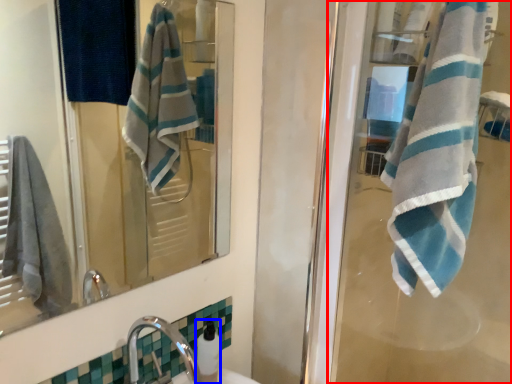
Question: Which point is closer to the camera, screen door (highlighted by a red box) or soap dispenser (highlighted by a blue box)?

Choices:
 (A) screen door
 (B) soap dispenser

Answer: (A)